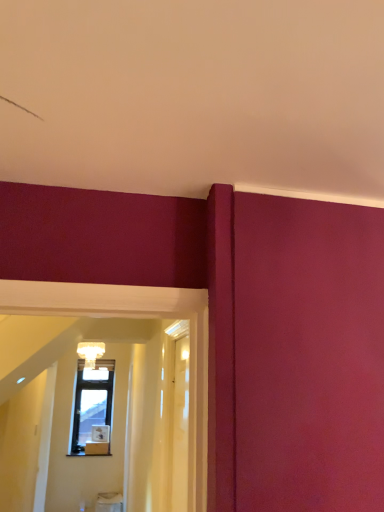
Question: Considering the relative positions of transparent glass door at center, marked as the second glass door in a left-to-right arrangement, and matte glass chandelier at upper center in the image provided, is transparent glass door at center, marked as the second glass door in a left-to-right arrangement, to the left of matte glass chandelier at upper center from the viewer's perspective?

Choices:
 (A) yes
 (B) no

Answer: (B)

Question: Is transparent glass door at center, marked as the second glass door in a left-to-right arrangement, looking in the opposite direction of matte glass chandelier at upper center?

Choices:
 (A) yes
 (B) no

Answer: (B)

Question: Does transparent glass door at center, marked as the second glass door in a left-to-right arrangement, have a lesser width compared to matte glass chandelier at upper center?

Choices:
 (A) yes
 (B) no

Answer: (A)

Question: Does transparent glass door at center, marked as the second glass door in a left-to-right arrangement, have a lesser height compared to matte glass chandelier at upper center?

Choices:
 (A) yes
 (B) no

Answer: (B)

Question: Is transparent glass door at center, marked as the 1th glass door in a right-to-left arrangement, touching matte glass chandelier at upper center?

Choices:
 (A) no
 (B) yes

Answer: (A)

Question: Is matte glass chandelier at upper center inside the boundaries of transparent wood door at center, marked as the second glass door in a right-to-left arrangement, or outside?

Choices:
 (A) outside
 (B) inside

Answer: (A)

Question: From a real-world perspective, is matte glass chandelier at upper center positioned above or below transparent wood door at center, acting as the first glass door starting from the left?

Choices:
 (A) below
 (B) above

Answer: (B)

Question: In the image, is matte glass chandelier at upper center positioned in front of or behind transparent wood door at center, acting as the first glass door starting from the left?

Choices:
 (A) behind
 (B) front

Answer: (A)

Question: In terms of width, does matte glass chandelier at upper center look wider or thinner when compared to transparent wood door at center, acting as the first glass door starting from the left?

Choices:
 (A) thin
 (B) wide

Answer: (B)

Question: Considering the positions of transparent wood door at center, marked as the second glass door in a right-to-left arrangement, and matte glass chandelier at upper center in the image, is transparent wood door at center, marked as the second glass door in a right-to-left arrangement, taller or shorter than matte glass chandelier at upper center?

Choices:
 (A) tall
 (B) short

Answer: (A)

Question: From a real-world perspective, is transparent wood door at center, marked as the second glass door in a right-to-left arrangement, positioned above or below matte glass chandelier at upper center?

Choices:
 (A) below
 (B) above

Answer: (A)

Question: From the image's perspective, relative to matte glass chandelier at upper center, is transparent wood door at center, acting as the first glass door starting from the left, above or below?

Choices:
 (A) above
 (B) below

Answer: (A)

Question: Is transparent wood door at center, acting as the first glass door starting from the left, bigger or smaller than matte glass chandelier at upper center?

Choices:
 (A) small
 (B) big

Answer: (A)

Question: Visually, is transparent glass door at center, marked as the second glass door in a left-to-right arrangement, positioned to the left or to the right of matte glass chandelier at upper center?

Choices:
 (A) left
 (B) right

Answer: (B)

Question: Looking at the image, does transparent glass door at center, marked as the second glass door in a left-to-right arrangement, seem bigger or smaller compared to matte glass chandelier at upper center?

Choices:
 (A) big
 (B) small

Answer: (A)